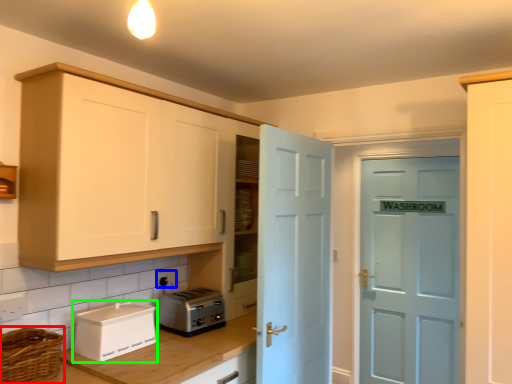
Question: Which object is the closest to the basket (highlighted by a red box)? Choose among these: electric outlet (highlighted by a blue box) or appliance (highlighted by a green box).

Choices:
 (A) electric outlet
 (B) appliance

Answer: (B)